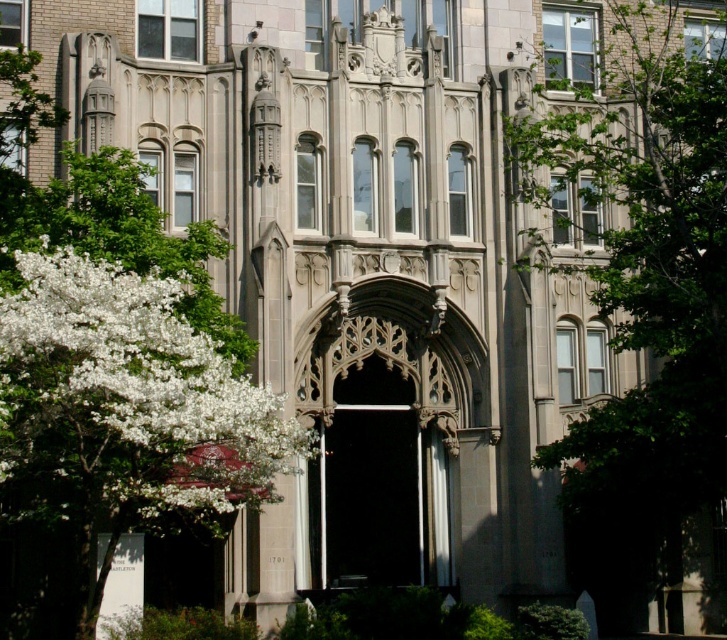
Image resolution: width=727 pixels, height=640 pixels. What do you see at coordinates (643, 280) in the screenshot? I see `green leafy tree at upper right` at bounding box center [643, 280].

Does green leafy tree at upper right appear on the right side of white blossoms at left?

Yes, green leafy tree at upper right is to the right of white blossoms at left.

The width and height of the screenshot is (727, 640). Identify the location of green leafy tree at upper right. (643, 280).